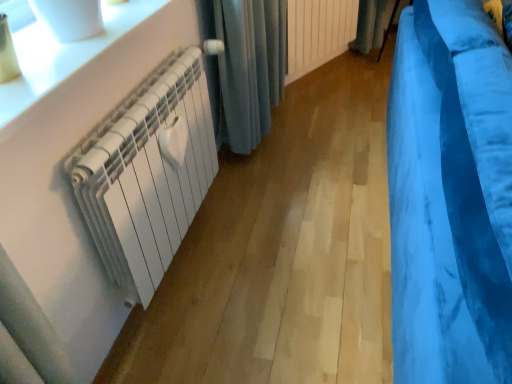
The height and width of the screenshot is (384, 512). I want to click on white glossy radiator at upper left, so click(x=63, y=54).

I want to click on white glossy radiator at upper left, so click(63, 54).

Which is more to the left, blue velvet curtain at upper right, positioned as the 1th curtain in top-to-bottom order, or white glossy radiator at upper left?

white glossy radiator at upper left is more to the left.

Considering the sizes of blue velvet curtain at upper right, positioned as the 1th curtain in top-to-bottom order, and white glossy radiator at upper left in the image, is blue velvet curtain at upper right, positioned as the 1th curtain in top-to-bottom order, wider or thinner than white glossy radiator at upper left?

blue velvet curtain at upper right, positioned as the 1th curtain in top-to-bottom order, is thinner than white glossy radiator at upper left.

Is blue velvet curtain at upper right, positioned as the 1th curtain in top-to-bottom order, situated inside white glossy radiator at upper left or outside?

blue velvet curtain at upper right, positioned as the 1th curtain in top-to-bottom order, is outside white glossy radiator at upper left.

From their relative heights in the image, would you say blue velvet curtain at upper right, acting as the first curtain starting from the back, is taller or shorter than white glossy radiator at upper left?

In the image, blue velvet curtain at upper right, acting as the first curtain starting from the back, appears to be taller than white glossy radiator at upper left.

Based on the photo, is white matte radiator at left, placed as the 2th radiator when sorted from right to left, oriented towards velvet blue curtain at right, which is the 1th curtain from front to back?

Yes, white matte radiator at left, placed as the 2th radiator when sorted from right to left, is facing velvet blue curtain at right, which is the 1th curtain from front to back.

Does point (115, 176) appear closer or farther from the camera than point (414, 244)?

Point (115, 176) is positioned farther from the camera compared to point (414, 244).

You are a GUI agent. You are given a task and a screenshot of the screen. Output one action in this format:
    pyautogui.click(x=<x>, y=<y>)
    Task: Click on the 2nd radiator to the left of the velvet blue curtain at right, acting as the second curtain starting from the back, counting from the anchor's position
    The image size is (512, 384).
    Given the screenshot: What is the action you would take?
    pyautogui.click(x=147, y=171)

Can you tell me how much white matte radiator at left, placed as the 2th radiator when sorted from right to left, and white glossy radiator at upper left differ in facing direction?

0.0675 degrees.

Is white glossy radiator at upper left at the back of white matte radiator at left, which appears as the first radiator when ordered from the bottom?

No, white matte radiator at left, which appears as the first radiator when ordered from the bottom, is not facing away from white glossy radiator at upper left.

Which object is positioned more to the left, white matte radiator at left, which appears as the first radiator when viewed from the front, or white glossy radiator at upper left?

white glossy radiator at upper left.

From a real-world perspective, is white matte radiator at left, placed as the 1th radiator when sorted from left to right, above or below white glossy radiator at upper left?

From a real-world perspective, white matte radiator at left, placed as the 1th radiator when sorted from left to right, is physically below white glossy radiator at upper left.

Does white glossy radiator at upper left have a larger size compared to white matte radiator at center, the 1th radiator viewed from the top?

No.

From the picture: Which of these two, white glossy radiator at upper left or white matte radiator at center, the second radiator when ordered from left to right, is wider?

white glossy radiator at upper left.

Which of these two, white glossy radiator at upper left or white matte radiator at center, the second radiator ordered from the bottom, stands taller?

white matte radiator at center, the second radiator ordered from the bottom.

Where is `window sill below the white matte radiator at center, the 1th radiator viewed from the top (from the image's perspective)`? window sill below the white matte radiator at center, the 1th radiator viewed from the top (from the image's perspective) is located at coordinates (63, 54).

Which object is closer to the camera, velvet blue curtain at right, marked as the second curtain in a top-to-bottom arrangement, or white glossy radiator at upper left?

velvet blue curtain at right, marked as the second curtain in a top-to-bottom arrangement, is in front.

Considering the sizes of objects velvet blue curtain at right, acting as the second curtain starting from the back, and white glossy radiator at upper left in the image provided, who is bigger, velvet blue curtain at right, acting as the second curtain starting from the back, or white glossy radiator at upper left?

With larger size is velvet blue curtain at right, acting as the second curtain starting from the back.

In terms of width, does velvet blue curtain at right, marked as the second curtain in a top-to-bottom arrangement, look wider or thinner when compared to white glossy radiator at upper left?

velvet blue curtain at right, marked as the second curtain in a top-to-bottom arrangement, is wider than white glossy radiator at upper left.

From the image's perspective, does velvet blue curtain at right, marked as the second curtain in a top-to-bottom arrangement, appear lower than white glossy radiator at upper left?

Yes.

Which is in front, velvet blue curtain at right, which is the 1th curtain from front to back, or white matte radiator at center, which ranks as the 2th radiator in front-to-back order?

velvet blue curtain at right, which is the 1th curtain from front to back, is in front.

Consider the image. Is velvet blue curtain at right, acting as the second curtain starting from the back, facing away from white matte radiator at center, the 1th radiator positioned from the right?

velvet blue curtain at right, acting as the second curtain starting from the back, does not have its back to white matte radiator at center, the 1th radiator positioned from the right.

Can you confirm if velvet blue curtain at right, which is the 1th curtain from front to back, is shorter than white matte radiator at center, the 1th radiator positioned from the right?

In fact, velvet blue curtain at right, which is the 1th curtain from front to back, may be taller than white matte radiator at center, the 1th radiator positioned from the right.

From the image's perspective, starting from the blue velvet curtain at upper right, the second curtain in the bottom-to-top sequence, which radiator is the 2nd one below? Please provide its 2D coordinates.

[(147, 171)]

From a real-world perspective, which object rests below the other?

blue velvet curtain at upper right, which is the second curtain in front-to-back order.

Consider the image. Is white matte radiator at left, which ranks as the 2th radiator in back-to-front order, next to blue velvet curtain at upper right, the second curtain in the bottom-to-top sequence?

No, white matte radiator at left, which ranks as the 2th radiator in back-to-front order, is not with blue velvet curtain at upper right, the second curtain in the bottom-to-top sequence.

Consider the image. Can we say white matte radiator at left, placed as the 2th radiator when sorted from right to left, lies outside blue velvet curtain at upper right, acting as the first curtain starting from the back?

That's correct, white matte radiator at left, placed as the 2th radiator when sorted from right to left, is outside of blue velvet curtain at upper right, acting as the first curtain starting from the back.

In the image, there is a white glossy radiator at upper left. In order to click on curtain above it (from the image's perspective) in this screenshot , I will do `click(373, 26)`.

Image resolution: width=512 pixels, height=384 pixels. In order to click on the 1st radiator behind the velvet blue curtain at right, which appears as the first curtain when ordered from the bottom in this screenshot , I will do `click(147, 171)`.

Looking at the image, which one is located closer to blue velvet curtain at upper right, acting as the first curtain starting from the back, white matte radiator at left, placed as the 1th radiator when sorted from left to right, or white matte radiator at center, the second radiator when ordered from left to right?

The object closer to blue velvet curtain at upper right, acting as the first curtain starting from the back, is white matte radiator at center, the second radiator when ordered from left to right.

Considering their positions, is white matte radiator at center, which ranks as the 2th radiator in front-to-back order, positioned further to blue velvet curtain at upper right, the second curtain in the bottom-to-top sequence, than velvet blue curtain at right, which appears as the first curtain when ordered from the bottom?

velvet blue curtain at right, which appears as the first curtain when ordered from the bottom, is further to blue velvet curtain at upper right, the second curtain in the bottom-to-top sequence.

Looking at the image, which one is located closer to white matte radiator at left, the 2th radiator positioned from the top, velvet blue curtain at right, acting as the second curtain starting from the back, or blue velvet curtain at upper right, the second curtain in the bottom-to-top sequence?

The object closer to white matte radiator at left, the 2th radiator positioned from the top, is velvet blue curtain at right, acting as the second curtain starting from the back.

Looking at this image, from the image, which object appears to be nearer to white glossy radiator at upper left, white matte radiator at left, which appears as the first radiator when viewed from the front, or velvet blue curtain at right, acting as the second curtain starting from the back?

white matte radiator at left, which appears as the first radiator when viewed from the front.

Which object lies nearer to the anchor point white matte radiator at center, acting as the first radiator starting from the back, white matte radiator at left, placed as the 2th radiator when sorted from right to left, or white glossy radiator at upper left?

white matte radiator at left, placed as the 2th radiator when sorted from right to left, is positioned closer to the anchor white matte radiator at center, acting as the first radiator starting from the back.

Which object lies nearer to the anchor point velvet blue curtain at right, which is the 1th curtain from front to back, white matte radiator at left, the 2th radiator positioned from the top, or white matte radiator at center, the 1th radiator viewed from the top?

white matte radiator at left, the 2th radiator positioned from the top, lies closer to velvet blue curtain at right, which is the 1th curtain from front to back, than the other object.

Based on their spatial positions, is blue velvet curtain at upper right, positioned as the 1th curtain in top-to-bottom order, or white glossy radiator at upper left closer to white matte radiator at center, the 1th radiator positioned from the right?

Among the two, blue velvet curtain at upper right, positioned as the 1th curtain in top-to-bottom order, is located nearer to white matte radiator at center, the 1th radiator positioned from the right.

Estimate the real-world distances between objects in this image. Which object is closer to white glossy radiator at upper left, white matte radiator at left, placed as the 2th radiator when sorted from right to left, or blue velvet curtain at upper right, positioned as the 1th curtain in top-to-bottom order?

The object closer to white glossy radiator at upper left is white matte radiator at left, placed as the 2th radiator when sorted from right to left.

Identify the location of window sill positioned between velvet blue curtain at right, marked as the second curtain in a top-to-bottom arrangement, and blue velvet curtain at upper right, positioned as the 1th curtain in top-to-bottom order, from near to far. (63, 54).

What are the coordinates of `radiator located between white glossy radiator at upper left and white matte radiator at center, the second radiator ordered from the bottom, in the depth direction` in the screenshot? It's located at (147, 171).

Locate an element on the screen. This screenshot has width=512, height=384. window sill positioned between velvet blue curtain at right, acting as the second curtain starting from the back, and white matte radiator at center, acting as the first radiator starting from the back, from near to far is located at coordinates (63, 54).

The width and height of the screenshot is (512, 384). In order to click on radiator located between velvet blue curtain at right, which is the 1th curtain from front to back, and white matte radiator at center, the second radiator when ordered from left to right, in the depth direction in this screenshot , I will do `click(147, 171)`.